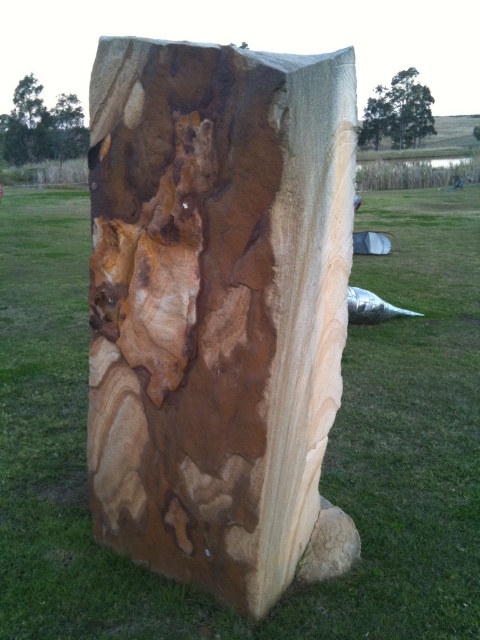
Question: Does green grass at center appear under brown wood tree at upper left?

Choices:
 (A) no
 (B) yes

Answer: (B)

Question: Which object appears closest to the camera in this image?

Choices:
 (A) brown wood tree at upper left
 (B) natural wood slab at center
 (C) green leafy tree at upper center

Answer: (B)

Question: Which object is farther from the camera taking this photo?

Choices:
 (A) green leafy tree at upper center
 (B) natural wood slab at center
 (C) brown wood tree at upper left

Answer: (A)

Question: Which point is closer to the camera?

Choices:
 (A) (57, 620)
 (B) (21, 122)

Answer: (A)

Question: Is brown wood tree at upper left thinner than green leafy tree at upper center?

Choices:
 (A) yes
 (B) no

Answer: (B)

Question: Does brown wood tree at upper left appear under green leafy tree at upper center?

Choices:
 (A) yes
 (B) no

Answer: (A)